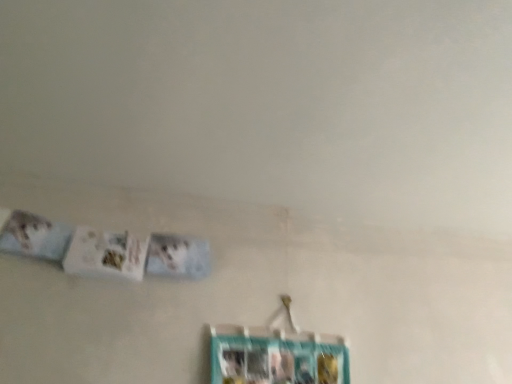
The image size is (512, 384). In order to click on teal plastic picture frame at lower center in this screenshot , I will do `click(276, 357)`.

This screenshot has height=384, width=512. Describe the element at coordinates (276, 357) in the screenshot. I see `teal plastic picture frame at lower center` at that location.

Measure the distance between point (230, 352) and camera.

Point (230, 352) is 4.25 feet away from camera.

Locate an element on the screen. The image size is (512, 384). teal plastic picture frame at lower center is located at coordinates (276, 357).